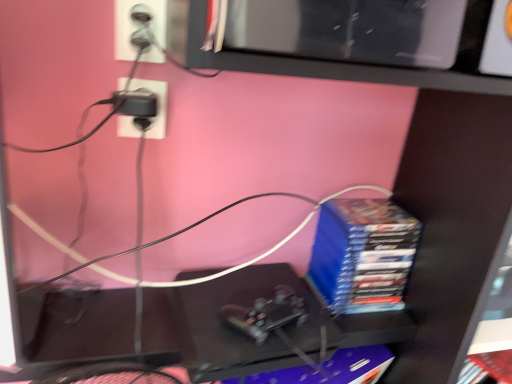
Identify the location of free space above purple matte paperback book at center, which is the second paperback book from top to bottom (from a real-world perspective). (332, 358).